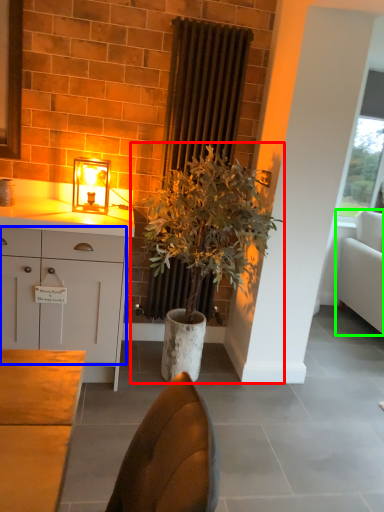
Question: Which is farther away from houseplant (highlighted by a red box)? cabinetry (highlighted by a blue box) or studio couch (highlighted by a green box)?

Choices:
 (A) cabinetry
 (B) studio couch

Answer: (B)